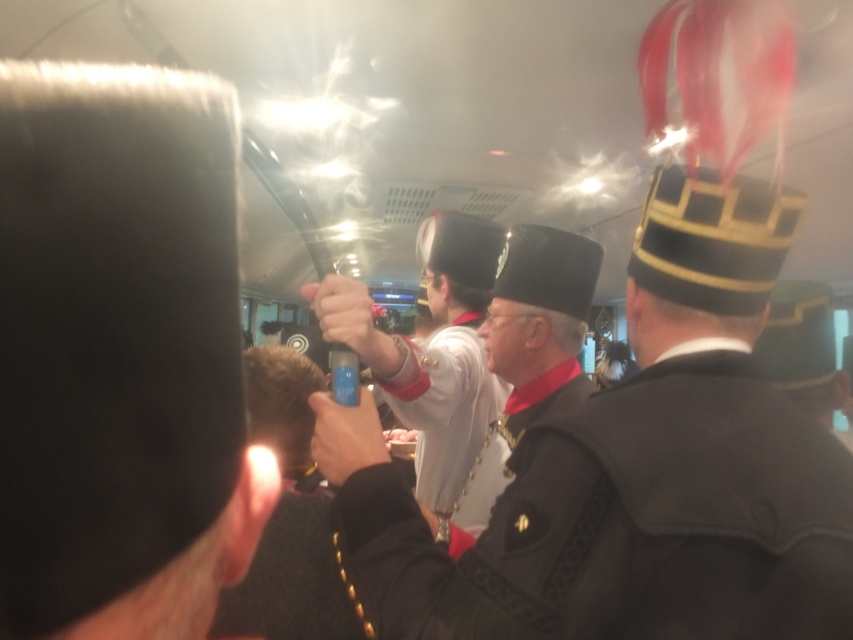
You are a photographer trying to capture a clear shot of the black fabric uniform at center and the matte black hat at center. Since both are in the same frame, which object should you focus on first to ensure it appears larger in your photo?

The black fabric uniform at center is taller than the matte black hat at center, so focusing on it first will ensure it appears larger in the photo.

You are a photographer at the event and need to capture a closeup of the matte black hat at center without the metallic silver can at center blocking the view. Which object should you move to ensure the hat is fully visible?

The metallic silver can at center is wider than the matte black hat at center, so moving the metallic silver can at center would allow the matte black hat at center to be fully visible without obstruction.